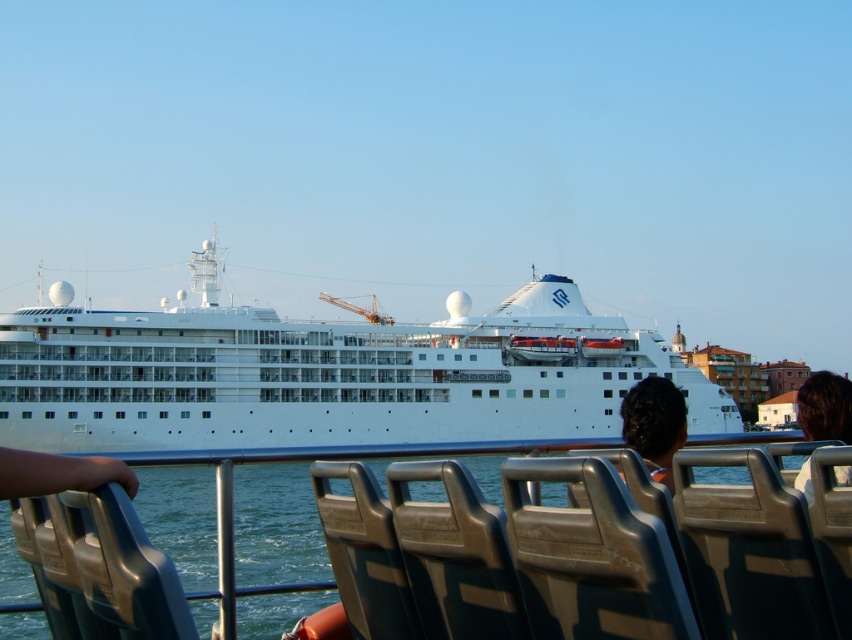
You are a passenger on the ferry and you see the skin tone flesh arm at lower left and the dark brown hair at upper right in your view. Which object is closer to you?

The skin tone flesh arm at lower left is closer to you because it is positioned under the dark brown hair at upper right, indicating it is in a lower and nearer position.

You are a photographer trying to capture the cruise ship in the center of your photo. You notice a person with an arm at lower left might block part of the ship. Based on their sizes, will the skin tone flesh arm at lower left cover the entire white glossy cruise ship at center in your photo?

The white glossy cruise ship at center is wider than the skin tone flesh arm at lower left, so the arm will not cover the entire ship in the photo.